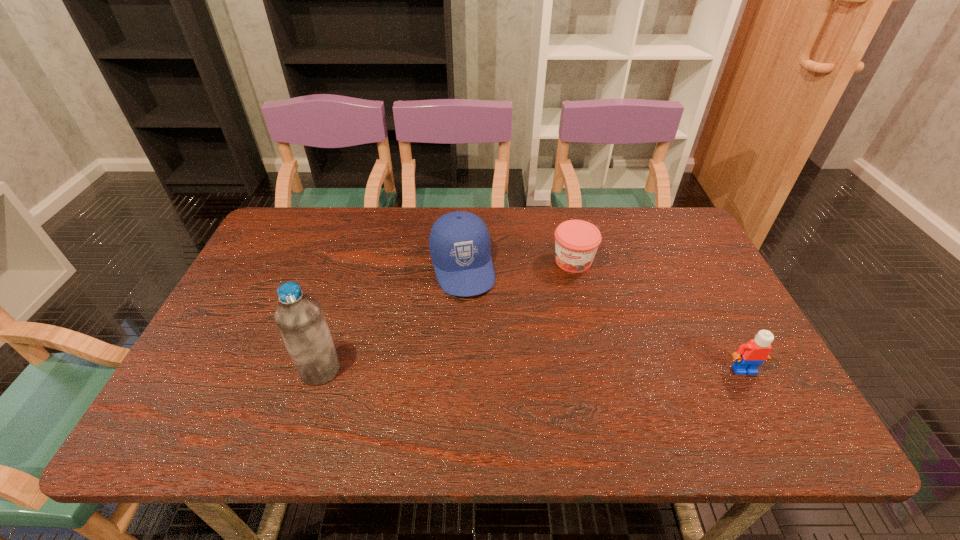
Where is `free space on the desktop that is between the water bottle and the rightmost object and is positioned on the front-facing side of the third object from right to left`? This screenshot has width=960, height=540. free space on the desktop that is between the water bottle and the rightmost object and is positioned on the front-facing side of the third object from right to left is located at coordinates (493, 370).

At what (x,y) coordinates should I click in order to perform the action: click on vacant space on the desktop that is between the tallest object and the Lego and is positioned on the front label of the third object from left to right. Please return your answer as a coordinate pair (x, y). The image size is (960, 540). Looking at the image, I should click on [x=531, y=370].